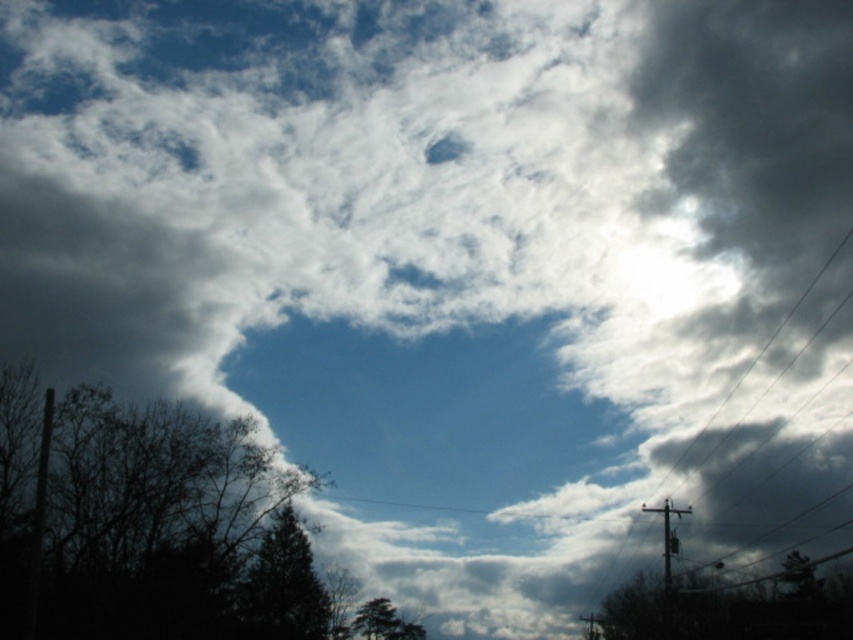
Is point (38, 449) positioned after point (412, 634)?

No.

Who is positioned more to the right, dark green leafy tree at lower left or green matte tree at lower center?

green matte tree at lower center

This screenshot has height=640, width=853. In order to click on dark green leafy tree at lower left in this screenshot , I will do `click(148, 524)`.

Measure the distance between point (276, 515) and camera.

Point (276, 515) is 61.66 meters from camera.

Can you confirm if green matte tree at lower left is shorter than green matte tree at lower center?

No, green matte tree at lower left is not shorter than green matte tree at lower center.

In order to click on green matte tree at lower left in this screenshot , I will do `click(281, 586)`.

The width and height of the screenshot is (853, 640). Identify the location of green leafy tree at lower right. (730, 611).

Can you confirm if green leafy tree at lower right is positioned to the right of green matte tree at lower center?

Indeed, green leafy tree at lower right is positioned on the right side of green matte tree at lower center.

The image size is (853, 640). In order to click on green leafy tree at lower right in this screenshot , I will do `click(730, 611)`.